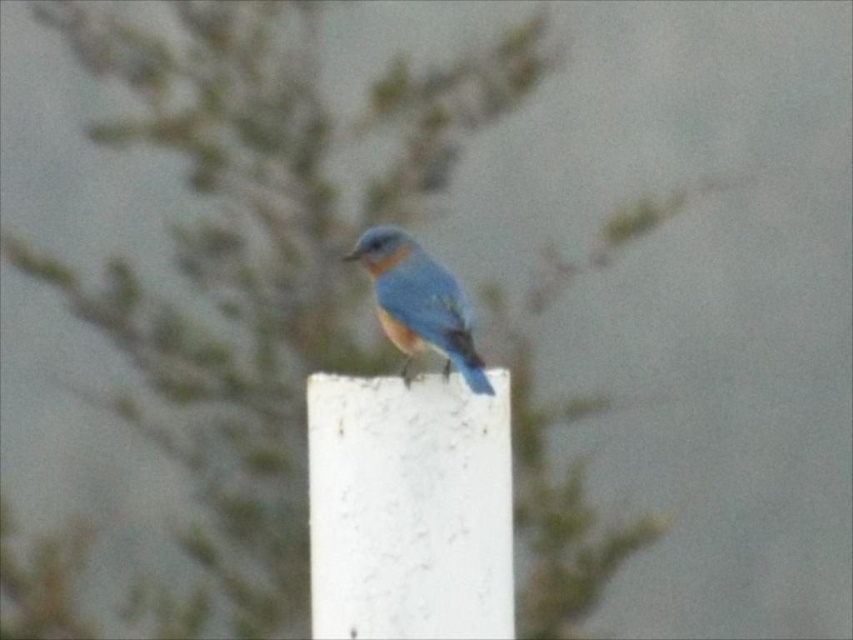
Question: Which point appears closest to the camera in this image?

Choices:
 (A) (509, 522)
 (B) (399, 252)

Answer: (A)

Question: Among these points, which one is nearest to the camera?

Choices:
 (A) (399, 483)
 (B) (402, 248)

Answer: (A)

Question: Is white textured pillar at center to the left of blue glossy bird at center from the viewer's perspective?

Choices:
 (A) yes
 (B) no

Answer: (A)

Question: Is white textured pillar at center to the left of blue glossy bird at center from the viewer's perspective?

Choices:
 (A) no
 (B) yes

Answer: (B)

Question: Does white textured pillar at center appear under blue glossy bird at center?

Choices:
 (A) yes
 (B) no

Answer: (A)